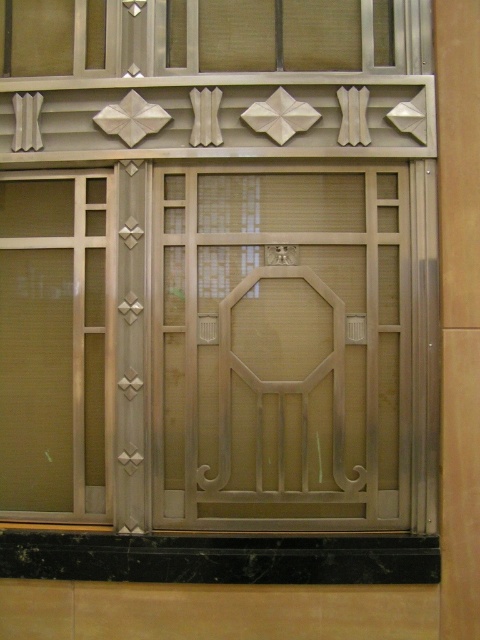
Who is more forward, (158,168) or (191,60)?

Point (158,168) is more forward.

Is matte gold screen door at center thinner than brushed metal window at upper center?

Yes, matte gold screen door at center is thinner than brushed metal window at upper center.

Image resolution: width=480 pixels, height=640 pixels. What do you see at coordinates (280, 348) in the screenshot? I see `matte gold screen door at center` at bounding box center [280, 348].

Locate an element on the screen. The height and width of the screenshot is (640, 480). matte gold screen door at center is located at coordinates (280, 348).